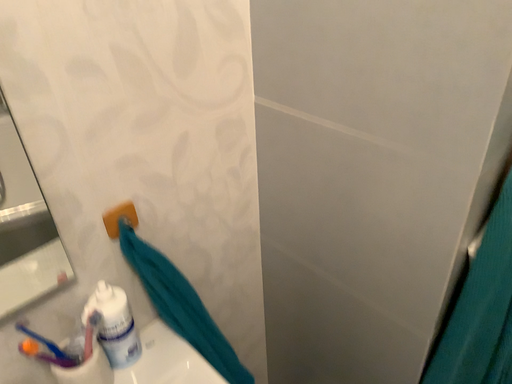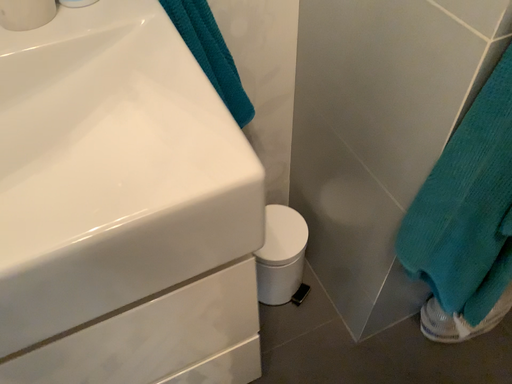
Question: Which way did the camera rotate in the video?

Choices:
 (A) rotated left
 (B) rotated right

Answer: (A)